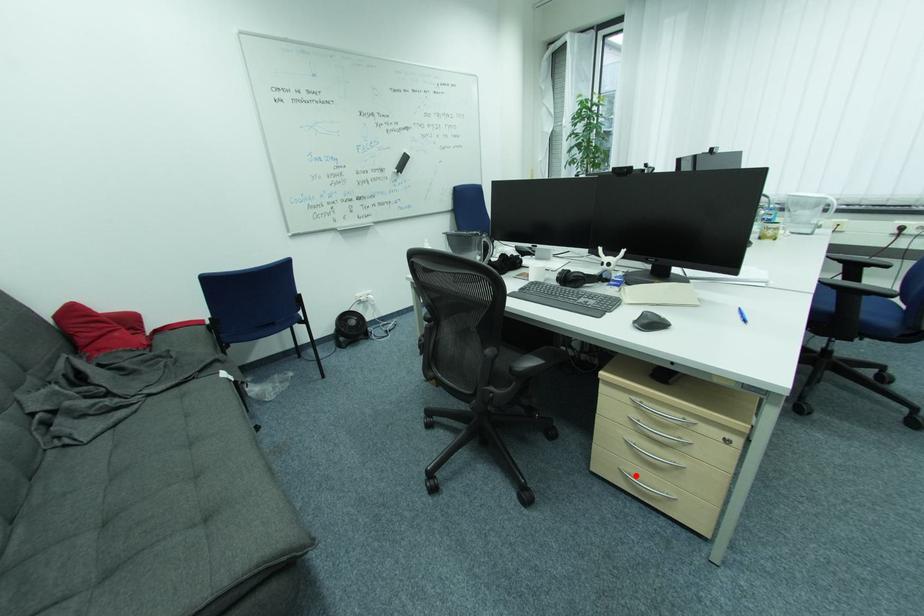
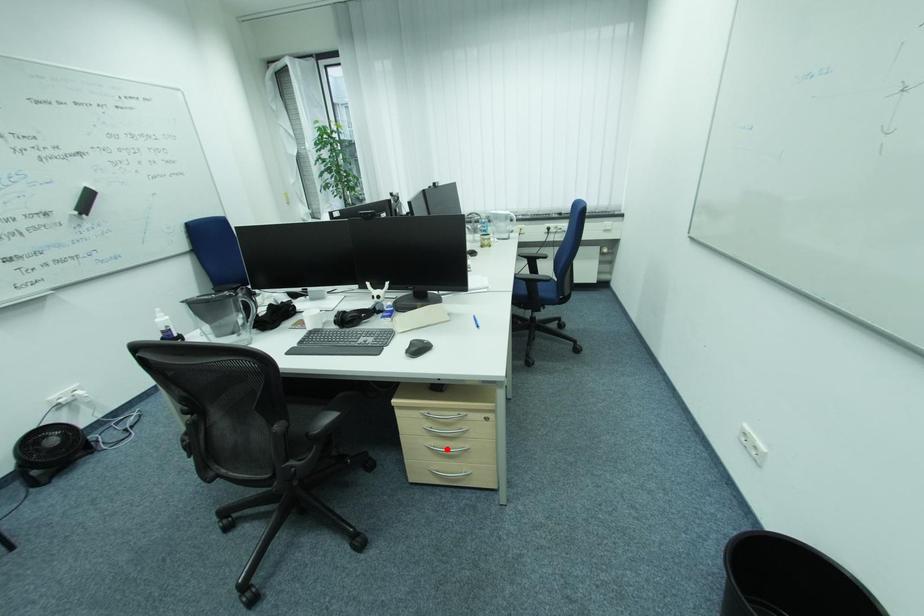
I am providing you with two images of the same scene from different viewpoints. A red point is marked on the first image and another point is marked on the second image. Does the point marked in image1 correspond to the same location as the one in image2?

No